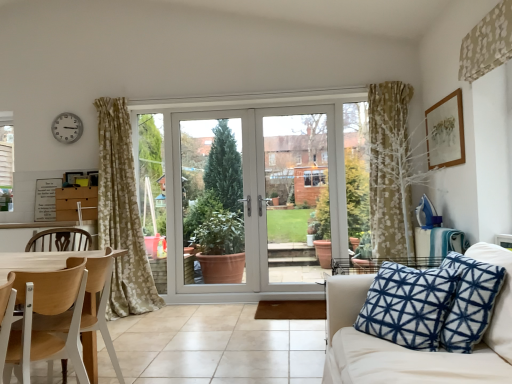
Question: Can you see clear glass door at center, the second screen door from the left, touching wooden chair at left?

Choices:
 (A) yes
 (B) no

Answer: (B)

Question: Does clear glass door at center, acting as the first screen door starting from the right, have a larger size compared to wooden chair at left?

Choices:
 (A) yes
 (B) no

Answer: (B)

Question: Is clear glass door at center, acting as the first screen door starting from the right, shorter than wooden chair at left?

Choices:
 (A) yes
 (B) no

Answer: (B)

Question: Does clear glass door at center, the second screen door from the left, come in front of wooden chair at left?

Choices:
 (A) no
 (B) yes

Answer: (A)

Question: From a real-world perspective, is clear glass door at center, the second screen door from the left, physically above wooden chair at left?

Choices:
 (A) yes
 (B) no

Answer: (A)

Question: Would you say wooden chair at left is to the left or to the right of wooden picture frame at upper right in the picture?

Choices:
 (A) left
 (B) right

Answer: (A)

Question: Looking at the image, does wooden chair at left seem bigger or smaller compared to wooden picture frame at upper right?

Choices:
 (A) big
 (B) small

Answer: (A)

Question: Considering their positions, is wooden chair at left located in front of or behind wooden picture frame at upper right?

Choices:
 (A) behind
 (B) front

Answer: (B)

Question: From their relative heights in the image, would you say wooden chair at left is taller or shorter than wooden picture frame at upper right?

Choices:
 (A) short
 (B) tall

Answer: (B)

Question: In the image, is white plastic door at center positioned in front of or behind wooden picture frame at upper right?

Choices:
 (A) front
 (B) behind

Answer: (B)

Question: Considering the positions of white plastic door at center and wooden picture frame at upper right in the image, is white plastic door at center bigger or smaller than wooden picture frame at upper right?

Choices:
 (A) big
 (B) small

Answer: (A)

Question: Considering the relative positions of white plastic door at center and wooden picture frame at upper right in the image provided, is white plastic door at center to the left or to the right of wooden picture frame at upper right?

Choices:
 (A) right
 (B) left

Answer: (B)

Question: From their relative heights in the image, would you say white plastic door at center is taller or shorter than wooden picture frame at upper right?

Choices:
 (A) short
 (B) tall

Answer: (B)

Question: From a real-world perspective, is matte silver clock at upper left above or below beige floral fabric at upper right?

Choices:
 (A) above
 (B) below

Answer: (B)

Question: From the image's perspective, is matte silver clock at upper left above or below beige floral fabric at upper right?

Choices:
 (A) above
 (B) below

Answer: (B)